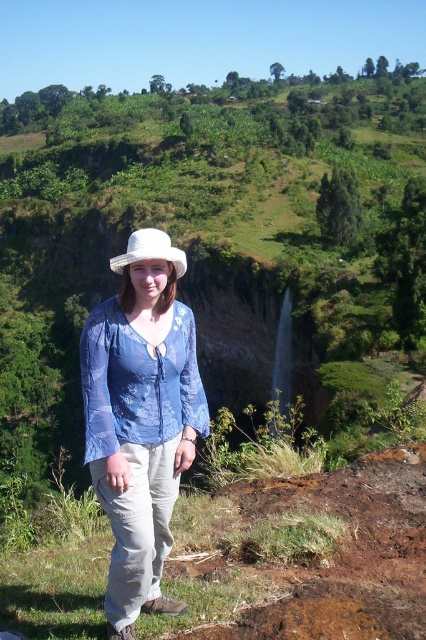
You are an artist trying to sketch this scene. You want to ensure that the proportions between the matte blue blouse at center and the white woven hat at upper center are accurate. Which object should you draw first to maintain proper scale, and why?

You should draw the white woven hat at upper center first because it occupies more space than the matte blue blouse at center, allowing you to establish its size before adjusting the blouse to fit proportionally.

You are a photographer trying to capture the person in the scene. If you want to focus on the matte blue blouse at center and the white woven hat at upper center, which object should you adjust your camera focus on first?

The matte blue blouse at center is positioned under the white woven hat at upper center, so you should focus on the white woven hat at upper center first as it is closer to the camera.